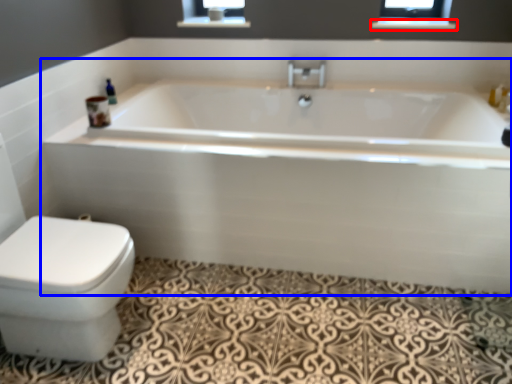
Question: Among these objects, which one is farthest to the camera, balustrade (highlighted by a red box) or bathtub (highlighted by a blue box)?

Choices:
 (A) balustrade
 (B) bathtub

Answer: (A)